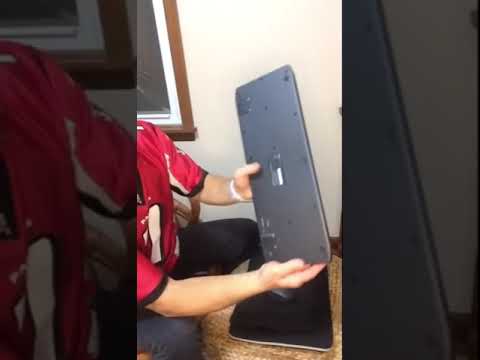
The width and height of the screenshot is (480, 360). I want to click on wall, so click(x=300, y=37).